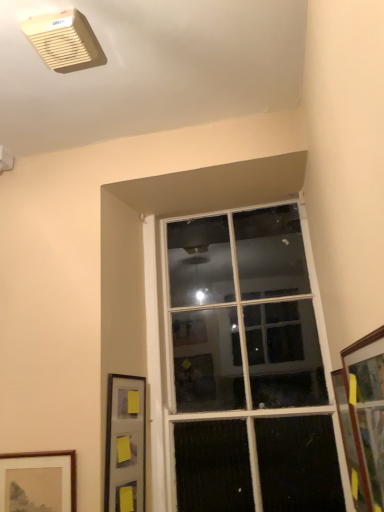
Question: Is wooden framed picture at lower left, which is counted as the 2th picture frame, starting from the back, bigger than clear glass window at center?

Choices:
 (A) no
 (B) yes

Answer: (A)

Question: Considering the relative sizes of wooden framed picture at lower left, acting as the first picture frame starting from the left, and clear glass window at center in the image provided, is wooden framed picture at lower left, acting as the first picture frame starting from the left, taller than clear glass window at center?

Choices:
 (A) yes
 (B) no

Answer: (B)

Question: From a real-world perspective, does wooden framed picture at lower left, the third picture frame when ordered from right to left, stand above clear glass window at center?

Choices:
 (A) no
 (B) yes

Answer: (A)

Question: Does wooden framed picture at lower left, the 2th picture frame when ordered from front to back, have a lesser width compared to clear glass window at center?

Choices:
 (A) yes
 (B) no

Answer: (A)

Question: From the image's perspective, is wooden framed picture at lower left, the third picture frame when ordered from right to left, beneath clear glass window at center?

Choices:
 (A) yes
 (B) no

Answer: (A)

Question: In terms of size, does beige plastic air conditioning unit at upper left appear bigger or smaller than clear glass window at center?

Choices:
 (A) small
 (B) big

Answer: (A)

Question: From a real-world perspective, is beige plastic air conditioning unit at upper left positioned above or below clear glass window at center?

Choices:
 (A) below
 (B) above

Answer: (B)

Question: Is beige plastic air conditioning unit at upper left taller or shorter than clear glass window at center?

Choices:
 (A) tall
 (B) short

Answer: (B)

Question: Considering the positions of point (62, 48) and point (228, 500), is point (62, 48) closer or farther from the camera than point (228, 500)?

Choices:
 (A) closer
 (B) farther

Answer: (A)

Question: Considering their positions, is beige plastic air conditioning unit at upper left located in front of or behind wooden framed picture at lower left, the third picture frame when ordered from right to left?

Choices:
 (A) front
 (B) behind

Answer: (A)

Question: From the image's perspective, is beige plastic air conditioning unit at upper left above or below wooden framed picture at lower left, acting as the first picture frame starting from the left?

Choices:
 (A) above
 (B) below

Answer: (A)

Question: Looking at their shapes, would you say beige plastic air conditioning unit at upper left is wider or thinner than wooden framed picture at lower left, the 2th picture frame when ordered from front to back?

Choices:
 (A) thin
 (B) wide

Answer: (B)

Question: From their relative heights in the image, would you say beige plastic air conditioning unit at upper left is taller or shorter than wooden framed picture at lower left, the third picture frame when ordered from right to left?

Choices:
 (A) short
 (B) tall

Answer: (A)

Question: Relative to wooden framed picture at lower left, acting as the first picture frame starting from the left, is clear glass window at center in front or behind?

Choices:
 (A) behind
 (B) front

Answer: (A)

Question: Would you say clear glass window at center is to the left or to the right of wooden framed picture at lower left, which is counted as the 2th picture frame, starting from the back, in the picture?

Choices:
 (A) left
 (B) right

Answer: (B)